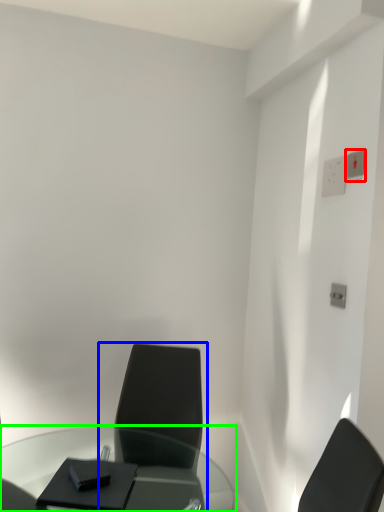
Question: Which object is positioned closest to electric outlet (highlighted by a red box)? Select from chair (highlighted by a blue box) and table (highlighted by a green box).

Choices:
 (A) chair
 (B) table

Answer: (A)